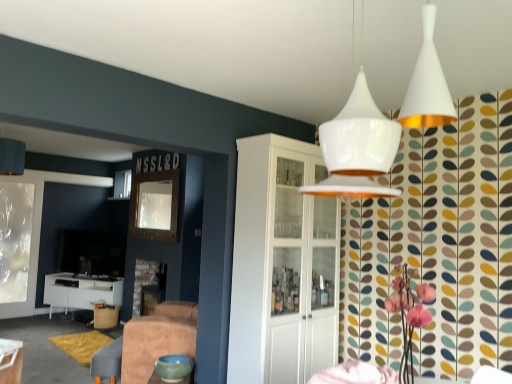
Question: From the image's perspective, is leather swivel chair at lower center above or below white glossy table at lower left, the 1th table viewed from the right?

Choices:
 (A) below
 (B) above

Answer: (A)

Question: From a real-world perspective, is leather swivel chair at lower center physically located above or below white glossy table at lower left, the 2th table viewed from the left?

Choices:
 (A) above
 (B) below

Answer: (B)

Question: Estimate the real-world distances between objects in this image. Which object is farther from the burlap stool at lower left?

Choices:
 (A) white glossy table at lower left, the 2th table when ordered from right to left
 (B) white glossy table at lower left, which is the 1th table from top to bottom
 (C) matte green bowl at lower center
 (D) white glossy cabinet at center
 (E) leather swivel chair at lower center

Answer: (D)

Question: Estimate the real-world distances between objects in this image. Which object is farther from the leather swivel chair at lower center?

Choices:
 (A) white glossy table at lower left, the 2th table when ordered from right to left
 (B) matte green bowl at lower center
 (C) white glossy table at lower left, the 1th table viewed from the right
 (D) burlap stool at lower left
 (E) white glossy cabinet at center

Answer: (A)